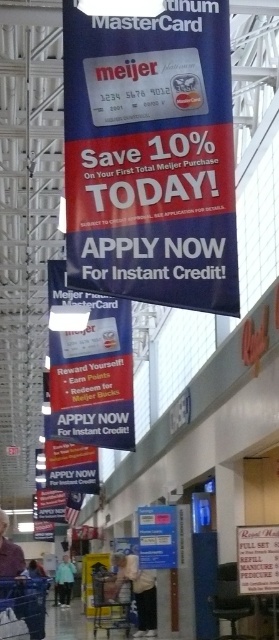
Question: Is matte plastic mastercard at center smaller than light blue fabric at lower center?

Choices:
 (A) no
 (B) yes

Answer: (B)

Question: Considering the real-world distances, which object is closest to the blue plastic sign at center?

Choices:
 (A) light blue fabric at lower center
 (B) matte plastic mastercard at center
 (C) metallic silver shopping cart at lower center
 (D) blue glossy mastercard at center

Answer: (C)

Question: Where is blue glossy mastercard at center located in relation to light blue denim jacket at lower left in the image?

Choices:
 (A) left
 (B) right

Answer: (B)

Question: Which of the following is the farthest from the observer?

Choices:
 (A) light blue fabric at lower center
 (B) white paper sign at lower right

Answer: (A)

Question: Which point appears closest to the camera in this image?

Choices:
 (A) (241, 545)
 (B) (20, 564)
 (C) (61, 598)
 (D) (95, 573)

Answer: (A)

Question: Is blue plastic sign at center smaller than metallic silver shopping cart at lower center?

Choices:
 (A) yes
 (B) no

Answer: (A)